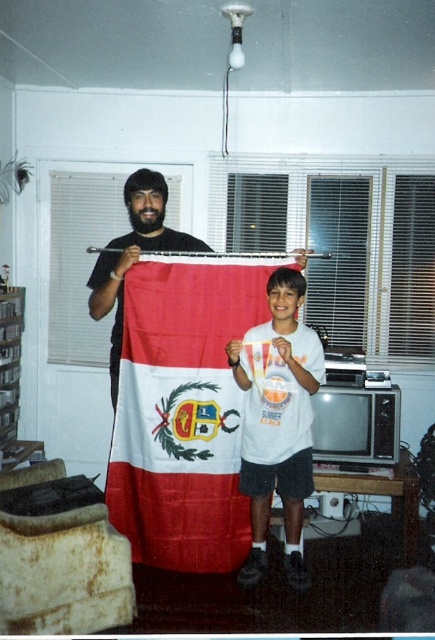
You are standing in the room and want to move from point A to point B. The coordinates of point A are point A at (173, 272) and point B are point B at (141, 202). Which point is closer to you?

Point A at (173, 272) is closer to you because it is further to the viewer than point B at (141, 202).